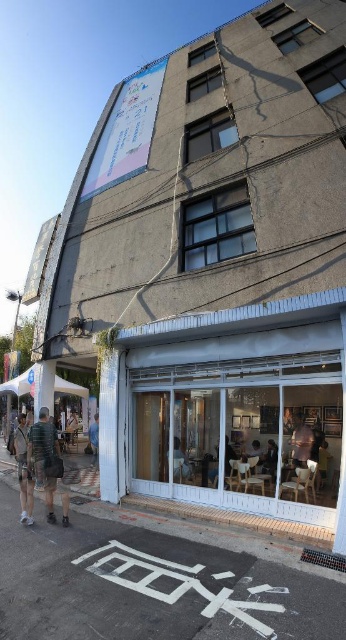
What do you see at coordinates (46, 458) in the screenshot?
I see `striped fabric shirt at lower left` at bounding box center [46, 458].

Does striped fabric shirt at lower left appear on the left side of camouflage fabric shorts at center?

No, striped fabric shirt at lower left is not to the left of camouflage fabric shorts at center.

Between point (40, 433) and point (25, 465), which one is positioned behind?

The point (40, 433) is behind.

Identify the location of striped fabric shirt at lower left. The width and height of the screenshot is (346, 640). (46, 458).

Between white glass storefront at lower right and blue fabric bag at lower center, which one appears on the left side from the viewer's perspective?

blue fabric bag at lower center

Who is shorter, white glass storefront at lower right or blue fabric bag at lower center?

blue fabric bag at lower center

Is point (131, 486) positioned behind point (95, 445)?

No, it is in front of (95, 445).

Locate an element on the screen. Image resolution: width=346 pixels, height=640 pixels. white glass storefront at lower right is located at coordinates (232, 410).

Is camouflage fabric shorts at center to the right of blue fabric bag at lower center from the viewer's perspective?

Indeed, camouflage fabric shorts at center is positioned on the right side of blue fabric bag at lower center.

How far apart are camouflage fabric shorts at center and blue fabric bag at lower center?

camouflage fabric shorts at center and blue fabric bag at lower center are 20.21 feet apart.

Which is in front, point (31, 484) or point (90, 429)?

Point (31, 484)

I want to click on camouflage fabric shorts at center, so click(23, 470).